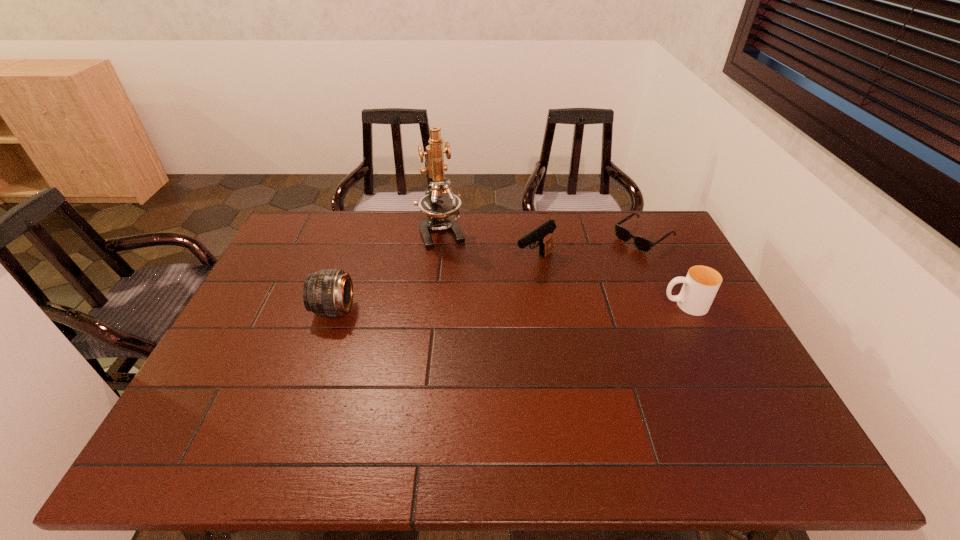
The width and height of the screenshot is (960, 540). I want to click on free point located 0.070m at the eyepiece of the second object from left to right, so click(x=453, y=263).

Find the location of a particular element. Image resolution: width=960 pixels, height=540 pixels. sunglasses that is at the far edge is located at coordinates (642, 244).

At what (x,y) coordinates should I click in order to perform the action: click on pistol located at the far edge. Please return your answer as a coordinate pair (x, y). Looking at the image, I should click on (543, 234).

Locate an element on the screen. microscope located at the far edge is located at coordinates (437, 205).

Locate an element on the screen. cup that is at the right edge is located at coordinates (701, 284).

Find the location of a particular element. This screenshot has height=540, width=960. sunglasses present at the right edge is located at coordinates (642, 244).

Locate an element on the screen. Image resolution: width=960 pixels, height=540 pixels. object situated at the far right corner is located at coordinates (642, 244).

Where is `vacant region at the far edge`? The width and height of the screenshot is (960, 540). vacant region at the far edge is located at coordinates (472, 220).

Where is `blank area at the near edge`? The width and height of the screenshot is (960, 540). blank area at the near edge is located at coordinates (332, 397).

In the image, there is a desktop. Where is `vacant space at the left edge`? This screenshot has height=540, width=960. vacant space at the left edge is located at coordinates (260, 304).